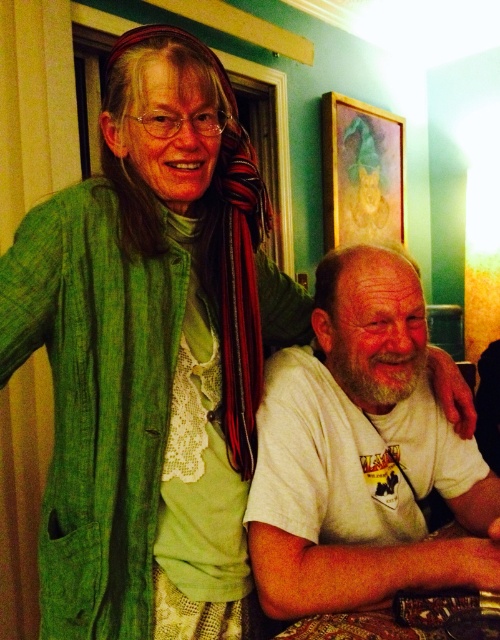
Question: Which point appears closest to the camera in this image?

Choices:
 (A) (350, 150)
 (B) (390, 420)

Answer: (B)

Question: Which point is farther to the camera?

Choices:
 (A) (323, 160)
 (B) (374, 321)

Answer: (A)

Question: From the image, what is the correct spatial relationship of white cotton t-shirt at center in relation to wooden frame at upper center?

Choices:
 (A) below
 (B) above

Answer: (A)

Question: Is white cotton t-shirt at center wider than wooden frame at upper center?

Choices:
 (A) yes
 (B) no

Answer: (B)

Question: Does white cotton t-shirt at center have a smaller size compared to wooden frame at upper center?

Choices:
 (A) no
 (B) yes

Answer: (B)

Question: Which object is farther from the camera taking this photo?

Choices:
 (A) wooden frame at upper center
 (B) white cotton t-shirt at center

Answer: (A)